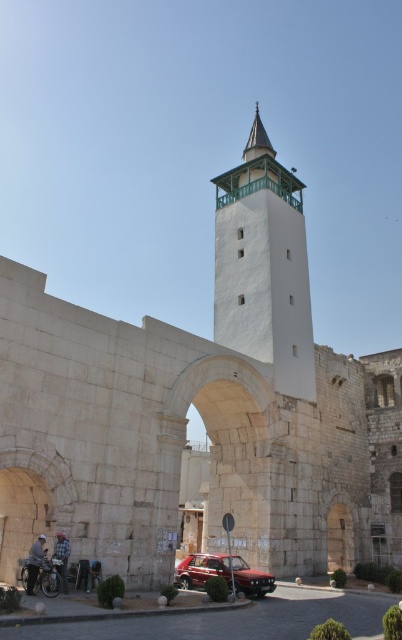
Can you confirm if metallic red car at center is shorter than blue plaid shirt at lower left?

No, metallic red car at center is not shorter than blue plaid shirt at lower left.

Is metallic red car at center to the left of blue plaid shirt at lower left from the viewer's perspective?

Incorrect, metallic red car at center is not on the left side of blue plaid shirt at lower left.

Is point (262, 592) closer to camera compared to point (61, 579)?

No.

At what (x,y) coordinates should I click in order to perform the action: click on metallic red car at center. Please return your answer as a coordinate pair (x, y). The height and width of the screenshot is (640, 402). Looking at the image, I should click on (223, 573).

Is point (262, 189) farther from viewer compared to point (235, 563)?

Yes, point (262, 189) is behind point (235, 563).

Does white stone minaret at center appear under metallic red car at center?

No.

What do you see at coordinates (264, 266) in the screenshot? I see `white stone minaret at center` at bounding box center [264, 266].

What are the coordinates of `white stone minaret at center` in the screenshot? It's located at (264, 266).

Consider the image. Is white stone minaret at center to the left of blue plaid shirt at lower left from the viewer's perspective?

No, white stone minaret at center is not to the left of blue plaid shirt at lower left.

Between point (254, 145) and point (65, 582), which one is positioned behind?

The point (254, 145) is behind.

Between point (217, 339) and point (63, 572), which one is positioned in front?

Point (63, 572) is more forward.

You are a GUI agent. You are given a task and a screenshot of the screen. Output one action in this format:
    pyautogui.click(x=<x>, y=<y>)
    Task: Click on the white stone minaret at center
    The width and height of the screenshot is (402, 640).
    Given the screenshot: What is the action you would take?
    pyautogui.click(x=264, y=266)